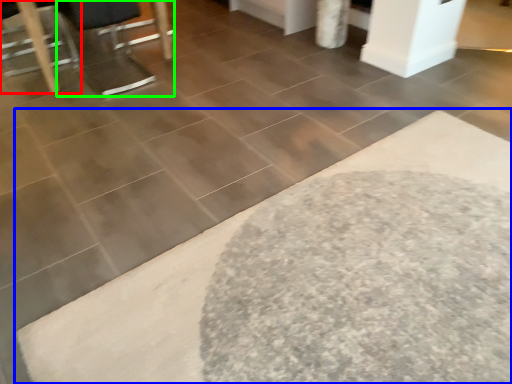
Question: Based on their relative distances, which object is farther from furniture (highlighted by a red box)? Choose from bath mat (highlighted by a blue box) and swivel chair (highlighted by a green box).

Choices:
 (A) bath mat
 (B) swivel chair

Answer: (A)